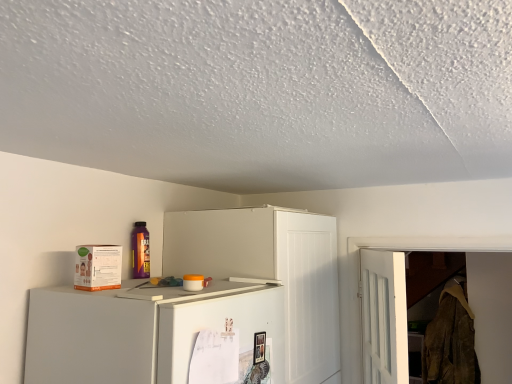
Locate an element on the screen. The width and height of the screenshot is (512, 384). white matte cabinet at upper center is located at coordinates (270, 275).

The image size is (512, 384). What do you see at coordinates (270, 275) in the screenshot?
I see `white matte cabinet at upper center` at bounding box center [270, 275].

This screenshot has width=512, height=384. What are the coordinates of `brown textured fabric at right` in the screenshot? It's located at (451, 340).

Describe the element at coordinates (451, 340) in the screenshot. I see `brown textured fabric at right` at that location.

Find the location of `white matte cabinet at upper center`. white matte cabinet at upper center is located at coordinates (270, 275).

Is white matte cabinet at upper center at the right side of brown textured fabric at right?

No, white matte cabinet at upper center is not to the right of brown textured fabric at right.

Does white matte cabinet at upper center lie in front of brown textured fabric at right?

That is True.

Is point (174, 363) in front of point (457, 308)?

That is True.

From the image's perspective, relative to brown textured fabric at right, is white matte cabinet at upper center above or below?

white matte cabinet at upper center is situated higher than brown textured fabric at right in the image.

From a real-world perspective, which is physically above, white matte cabinet at upper center or brown textured fabric at right?

white matte cabinet at upper center, from a real-world perspective.

Does white matte cabinet at upper center have a lesser width compared to brown textured fabric at right?

In fact, white matte cabinet at upper center might be wider than brown textured fabric at right.

Considering the relative sizes of white matte cabinet at upper center and brown textured fabric at right in the image provided, is white matte cabinet at upper center taller than brown textured fabric at right?

Correct, white matte cabinet at upper center is much taller as brown textured fabric at right.

Can you confirm if white matte cabinet at upper center is bigger than brown textured fabric at right?

Indeed, white matte cabinet at upper center has a larger size compared to brown textured fabric at right.

From the picture: Which is correct: white matte cabinet at upper center is inside brown textured fabric at right, or outside of it?

white matte cabinet at upper center lies outside brown textured fabric at right.

Is white matte cabinet at upper center in contact with brown textured fabric at right?

No, white matte cabinet at upper center is not beside brown textured fabric at right.

Could you tell me if white matte cabinet at upper center is turned towards brown textured fabric at right?

No, white matte cabinet at upper center is not aimed at brown textured fabric at right.

Identify the location of laundry on the right of white matte cabinet at upper center. Image resolution: width=512 pixels, height=384 pixels. (451, 340).

Considering the positions of objects brown textured fabric at right and white matte cabinet at upper center in the image provided, who is more to the right, brown textured fabric at right or white matte cabinet at upper center?

brown textured fabric at right.

Which object is closer to the camera, brown textured fabric at right or white matte cabinet at upper center?

Positioned in front is white matte cabinet at upper center.

Is point (456, 369) positioned before point (314, 371)?

No, it is behind (314, 371).

From the image's perspective, does brown textured fabric at right appear higher than white matte cabinet at upper center?

Incorrect, from the image's perspective, brown textured fabric at right is lower than white matte cabinet at upper center.

From a real-world perspective, does brown textured fabric at right sit lower than white matte cabinet at upper center?

Yes, from a real-world perspective, brown textured fabric at right is under white matte cabinet at upper center.

Which of these two, brown textured fabric at right or white matte cabinet at upper center, is wider?

white matte cabinet at upper center.

Is brown textured fabric at right taller or shorter than white matte cabinet at upper center?

brown textured fabric at right is shorter than white matte cabinet at upper center.

Based on their sizes in the image, would you say brown textured fabric at right is bigger or smaller than white matte cabinet at upper center?

Clearly, brown textured fabric at right is smaller in size than white matte cabinet at upper center.

Would you say brown textured fabric at right is outside white matte cabinet at upper center?

Yes, brown textured fabric at right is located beyond the bounds of white matte cabinet at upper center.

Is brown textured fabric at right in contact with white matte cabinet at upper center?

No, brown textured fabric at right is not touching white matte cabinet at upper center.

Is brown textured fabric at right turned away from white matte cabinet at upper center?

No.

How much distance is there between brown textured fabric at right and white matte cabinet at upper center?

4.16 feet.

The height and width of the screenshot is (384, 512). I want to click on laundry that appears behind the white matte cabinet at upper center, so click(451, 340).

Where is `cabinetry on the left of brown textured fabric at right`? cabinetry on the left of brown textured fabric at right is located at coordinates [x=270, y=275].

You are a GUI agent. You are given a task and a screenshot of the screen. Output one action in this format:
    pyautogui.click(x=<x>, y=<y>)
    Task: Click on the cabinetry that appears above the brown textured fabric at right (from the image's perspective)
    This screenshot has width=512, height=384.
    Given the screenshot: What is the action you would take?
    pyautogui.click(x=270, y=275)